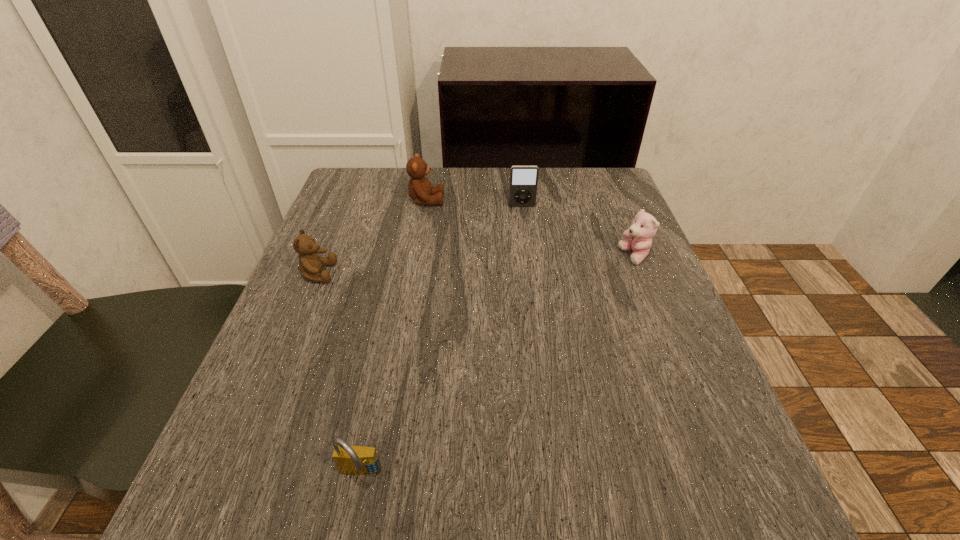
This screenshot has height=540, width=960. Identify the location of free space at the right edge of the desktop. (655, 451).

In the image, there is a desktop. Identify the location of vacant space at the far left corner. This screenshot has height=540, width=960. (392, 193).

The width and height of the screenshot is (960, 540). I want to click on vacant space at the far right corner, so click(x=563, y=172).

In the image, there is a desktop. Where is `vacant area at the near right corner`? This screenshot has width=960, height=540. vacant area at the near right corner is located at coordinates pos(756,479).

The height and width of the screenshot is (540, 960). What are the coordinates of `free space between the padlock and the iPod` in the screenshot? It's located at (x=441, y=341).

Locate an element on the screen. The height and width of the screenshot is (540, 960). free space between the fourth object from left to right and the second teddy bear from right to left is located at coordinates click(474, 204).

Identify the location of free space that is in between the rightmost teddy bear and the padlock. (497, 366).

Where is `free space between the nearest object and the second object from right to left`? This screenshot has height=540, width=960. free space between the nearest object and the second object from right to left is located at coordinates (441, 341).

The height and width of the screenshot is (540, 960). I want to click on blank region between the nearest object and the fourth object from left to right, so click(x=441, y=341).

This screenshot has height=540, width=960. In order to click on vacant space that is in between the farthest teddy bear and the nearest object in this screenshot , I will do `click(394, 338)`.